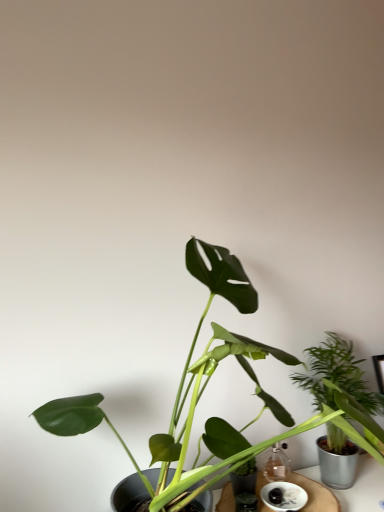
Question: Does white ceramic saucer at lower center touch wooden table at center?

Choices:
 (A) yes
 (B) no

Answer: (A)

Question: Considering the relative sizes of white ceramic saucer at lower center and wooden table at center in the image provided, is white ceramic saucer at lower center bigger than wooden table at center?

Choices:
 (A) no
 (B) yes

Answer: (A)

Question: Does white ceramic saucer at lower center appear on the right side of wooden table at center?

Choices:
 (A) no
 (B) yes

Answer: (B)

Question: From the image's perspective, is white ceramic saucer at lower center on wooden table at center?

Choices:
 (A) yes
 (B) no

Answer: (A)

Question: Does white ceramic saucer at lower center have a smaller size compared to wooden table at center?

Choices:
 (A) no
 (B) yes

Answer: (B)

Question: Does white ceramic saucer at lower center turn towards wooden table at center?

Choices:
 (A) yes
 (B) no

Answer: (B)

Question: Can you confirm if green matte leafy plant at center, placed as the 2th houseplant when sorted from back to front, is thinner than green leafy plant at right, which is the 2th houseplant in front-to-back order?

Choices:
 (A) yes
 (B) no

Answer: (B)

Question: Is green matte leafy plant at center, placed as the 2th houseplant when sorted from back to front, far away from green leafy plant at right, arranged as the 1th houseplant when viewed from the back?

Choices:
 (A) no
 (B) yes

Answer: (A)

Question: Does green matte leafy plant at center, marked as the first houseplant in a front-to-back arrangement, appear on the left side of green leafy plant at right, arranged as the 1th houseplant when viewed from the back?

Choices:
 (A) yes
 (B) no

Answer: (A)

Question: Is green leafy plant at right, which is the 2th houseplant in front-to-back order, at the back of green matte leafy plant at center, marked as the first houseplant in a front-to-back arrangement?

Choices:
 (A) no
 (B) yes

Answer: (A)

Question: From the image's perspective, is green matte leafy plant at center, placed as the 2th houseplant when sorted from back to front, below green leafy plant at right, which is the 2th houseplant in front-to-back order?

Choices:
 (A) yes
 (B) no

Answer: (B)

Question: From a real-world perspective, is green matte leafy plant at center, marked as the first houseplant in a front-to-back arrangement, under green leafy plant at right, which is the 2th houseplant in front-to-back order?

Choices:
 (A) no
 (B) yes

Answer: (A)

Question: Considering the relative sizes of green leafy plant at right, which is the 2th houseplant in front-to-back order, and green matte leafy plant at center, marked as the first houseplant in a front-to-back arrangement, in the image provided, is green leafy plant at right, which is the 2th houseplant in front-to-back order, shorter than green matte leafy plant at center, marked as the first houseplant in a front-to-back arrangement,?

Choices:
 (A) yes
 (B) no

Answer: (A)